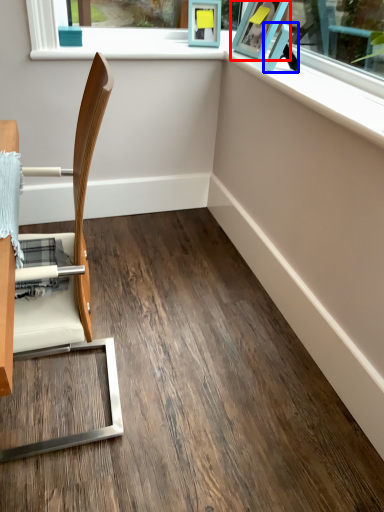
Question: Which of the following is the closest to the observer, picture frame (highlighted by a red box) or picture frame (highlighted by a blue box)?

Choices:
 (A) picture frame
 (B) picture frame

Answer: (B)